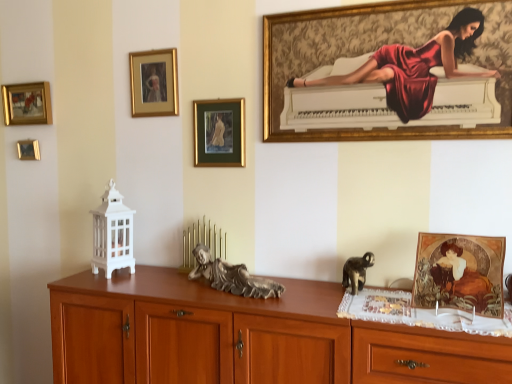
You are a GUI agent. You are given a task and a screenshot of the screen. Output one action in this format:
    pyautogui.click(x=<x>, y=<y>)
    Task: Click on the vacant area to the right of silver metallic statue at center, the 2th animal in the right-to-left sequence
    The height and width of the screenshot is (384, 512).
    Given the screenshot: What is the action you would take?
    pyautogui.click(x=309, y=293)